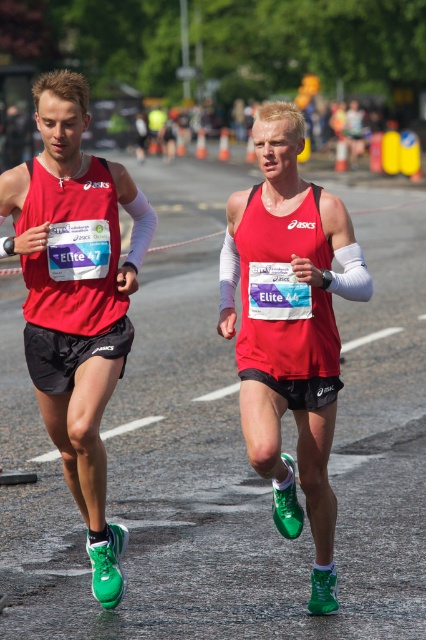
Question: Is matte red tank top at left further to camera compared to matte red tank top at center?

Choices:
 (A) yes
 (B) no

Answer: (A)

Question: Is matte red tank top at left behind matte red tank top at center?

Choices:
 (A) no
 (B) yes

Answer: (B)

Question: Which object is closer to the camera taking this photo?

Choices:
 (A) matte red tank top at center
 (B) matte red tank top at left

Answer: (A)

Question: Is matte red tank top at left positioned behind matte red tank top at center?

Choices:
 (A) no
 (B) yes

Answer: (B)

Question: Which point is closer to the camera?

Choices:
 (A) matte red tank top at left
 (B) matte red tank top at center

Answer: (B)

Question: Which object appears farthest from the camera in this image?

Choices:
 (A) matte red tank top at left
 (B) matte red tank top at center

Answer: (A)